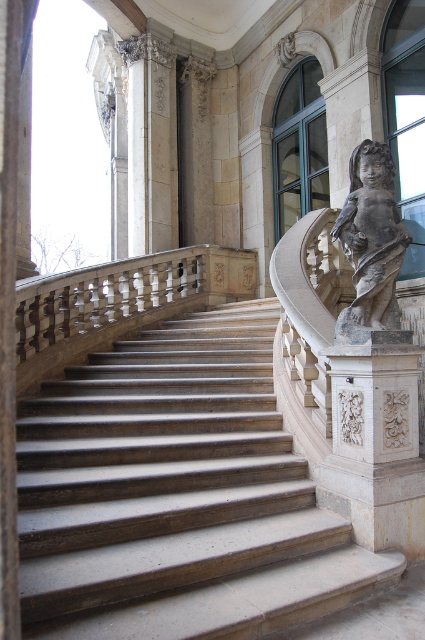
Can you confirm if smooth stone stairs at center is taller than gray stone cherub at right?

No.

Between smooth stone stairs at center and gray stone cherub at right, which one appears on the right side from the viewer's perspective?

From the viewer's perspective, gray stone cherub at right appears more on the right side.

Is point (67, 371) closer to camera compared to point (357, 168)?

No, (67, 371) is behind (357, 168).

This screenshot has width=425, height=640. I want to click on smooth stone stairs at center, so click(176, 493).